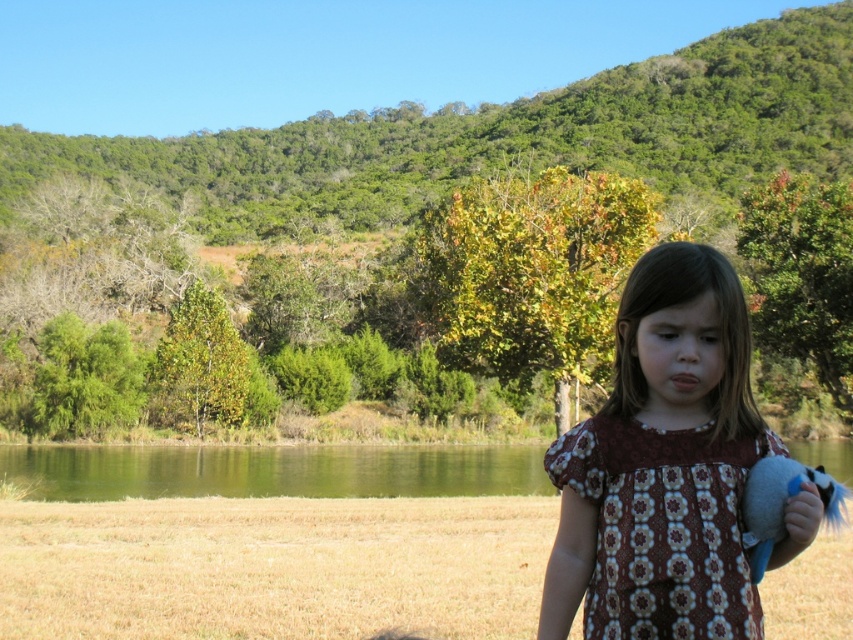
Question: Estimate the real-world distances between objects in this image. Which object is closer to the brown floral fabric dress at center?

Choices:
 (A) brown printed dress at center
 (B) fluffy plush toy at lower right
 (C) green liquid water at lower center

Answer: (A)

Question: Which of the following is the closest to the observer?

Choices:
 (A) (801, 476)
 (B) (309, 484)
 (C) (679, 548)

Answer: (A)

Question: Is brown printed dress at center to the right of fluffy plush toy at lower right from the viewer's perspective?

Choices:
 (A) no
 (B) yes

Answer: (A)

Question: Which object is positioned farthest from the green liquid water at lower center?

Choices:
 (A) fluffy plush toy at lower right
 (B) brown floral fabric dress at center

Answer: (A)

Question: Is green liquid water at lower center thinner than fluffy plush toy at lower right?

Choices:
 (A) yes
 (B) no

Answer: (B)

Question: Is the position of brown printed dress at center more distant than that of brown floral fabric dress at center?

Choices:
 (A) yes
 (B) no

Answer: (B)